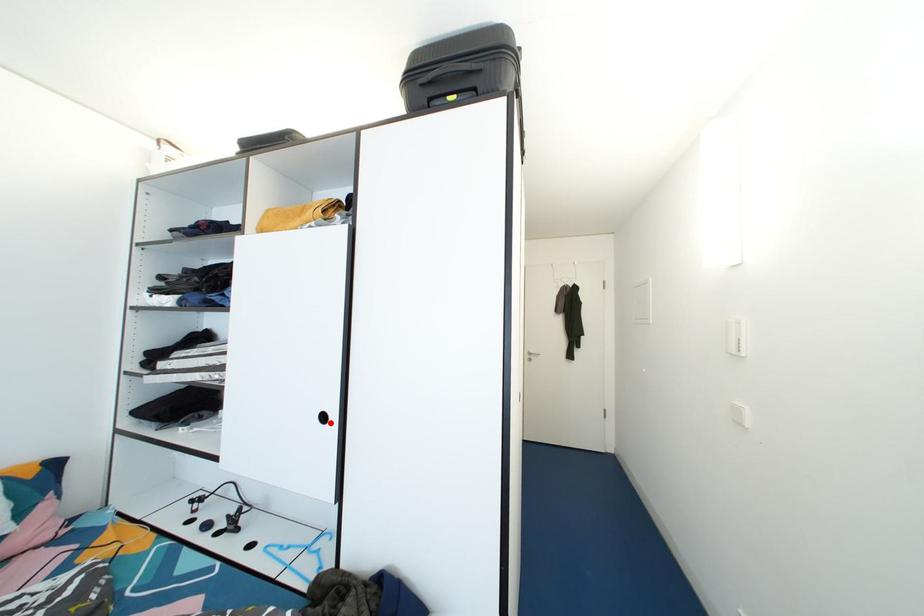
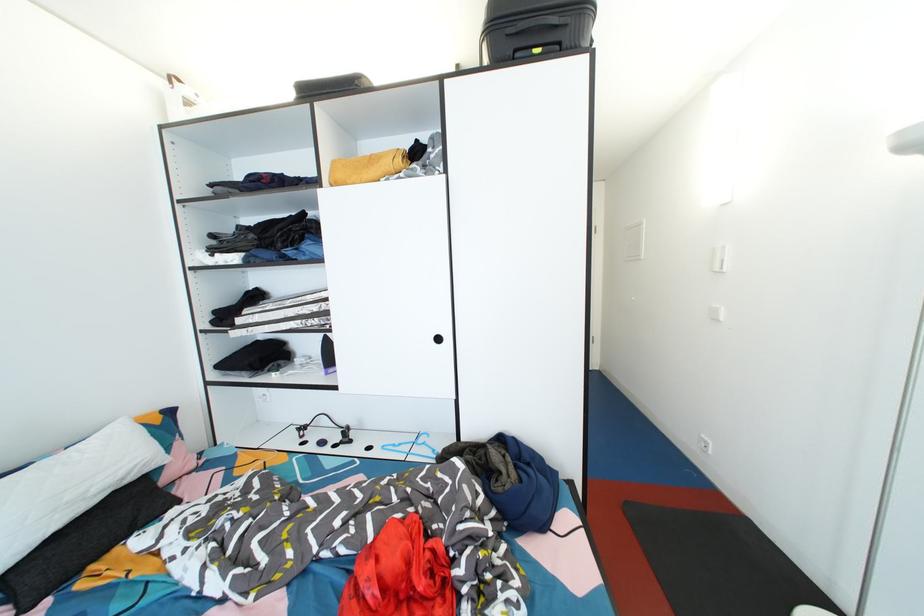
Locate, in the second image, the point that corresponds to the highlighted location in the first image.

(444, 344)